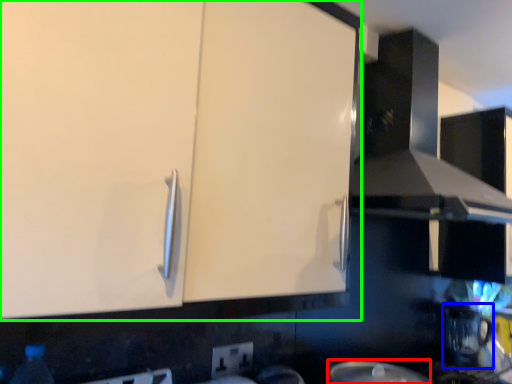
Question: Based on their relative distances, which object is nearer to appliance (highlighted by a red box)? Choose from coffee machine (highlighted by a blue box) and cabinetry (highlighted by a green box).

Choices:
 (A) coffee machine
 (B) cabinetry

Answer: (B)